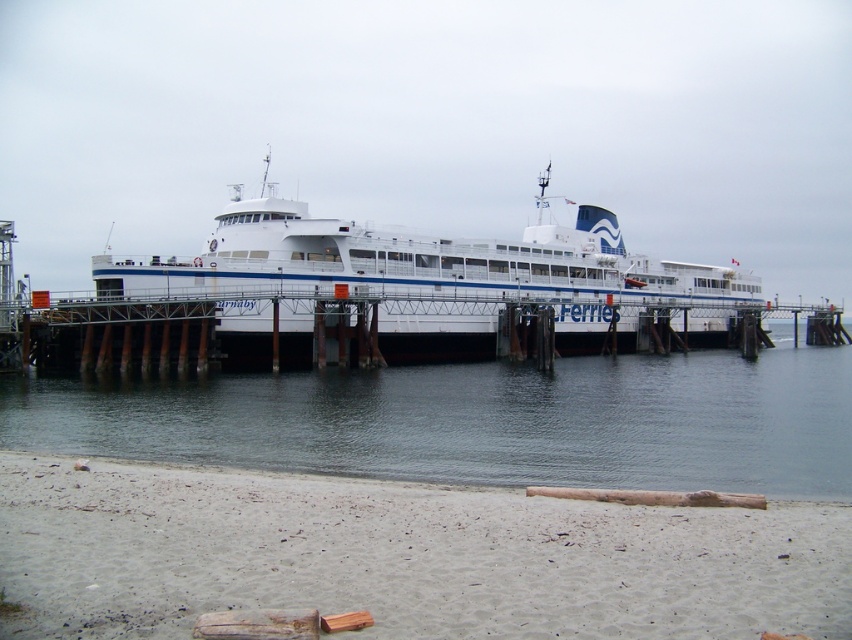
Question: Is smooth sand beach at lower center above wooden at center?

Choices:
 (A) yes
 (B) no

Answer: (B)

Question: Does smooth sand beach at lower center have a lesser width compared to white matte ferry at center?

Choices:
 (A) yes
 (B) no

Answer: (A)

Question: Which point is farther to the camera?

Choices:
 (A) smooth sand beach at lower center
 (B) wooden at center

Answer: (B)

Question: Is clear water at center to the right of white matte ferry at center from the viewer's perspective?

Choices:
 (A) yes
 (B) no

Answer: (A)

Question: Among these points, which one is nearest to the camera?

Choices:
 (A) (540, 400)
 (B) (609, 214)

Answer: (A)

Question: Considering the real-world distances, which object is closest to the clear water at center?

Choices:
 (A) white matte ferry at center
 (B) wooden at center
 (C) smooth sand beach at lower center

Answer: (B)